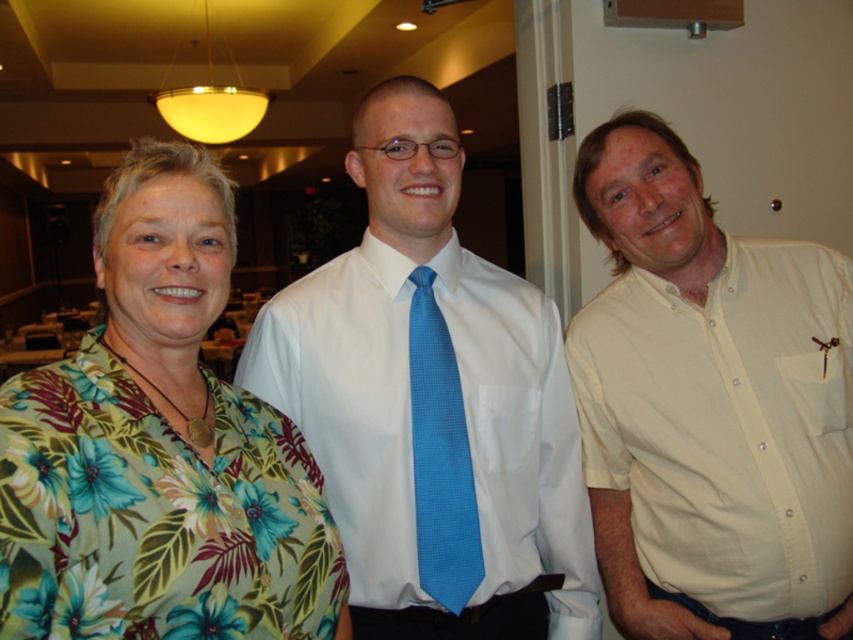
Can you confirm if white smooth shirt at center is wider than blue silk tie at center?

Yes, white smooth shirt at center is wider than blue silk tie at center.

Image resolution: width=853 pixels, height=640 pixels. Describe the element at coordinates (432, 403) in the screenshot. I see `white smooth shirt at center` at that location.

Between point (367, 516) and point (422, 472), which one is positioned in front?

Point (422, 472)

Where is `white smooth shirt at center`? The width and height of the screenshot is (853, 640). white smooth shirt at center is located at coordinates (432, 403).

Who is higher up, yellow cotton shirt at right or floral print blouse at left?

Positioned higher is floral print blouse at left.

Between yellow cotton shirt at right and floral print blouse at left, which one is positioned lower?

yellow cotton shirt at right is lower down.

Who is more distant from viewer, (730, 492) or (186, 220)?

The point (730, 492) is more distant.

Where is `yellow cotton shirt at right`? yellow cotton shirt at right is located at coordinates (711, 404).

Is white smooth shirt at center behind yellow cotton shirt at right?

No, white smooth shirt at center is in front of yellow cotton shirt at right.

What do you see at coordinates (432, 403) in the screenshot? The height and width of the screenshot is (640, 853). I see `white smooth shirt at center` at bounding box center [432, 403].

I want to click on white smooth shirt at center, so click(432, 403).